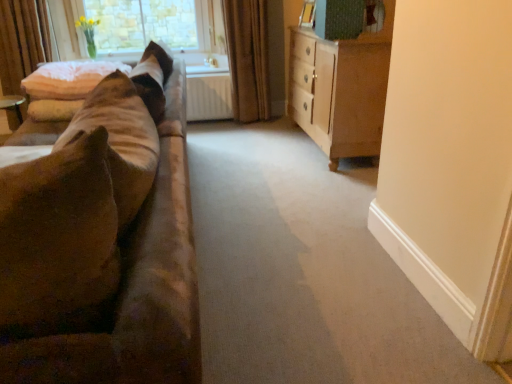
Locate an element on the screen. empty space that is to the right of suede-like brown couch at left is located at coordinates (289, 236).